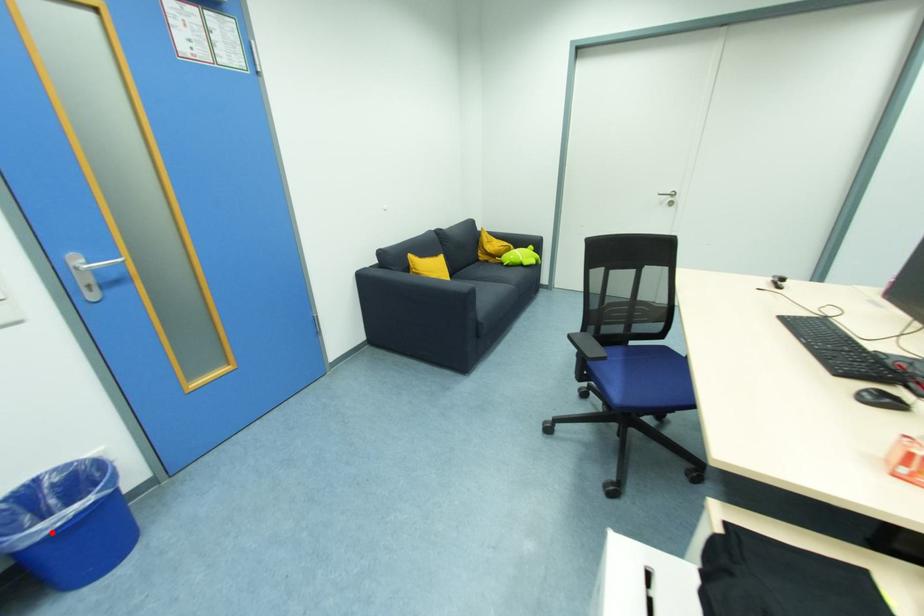
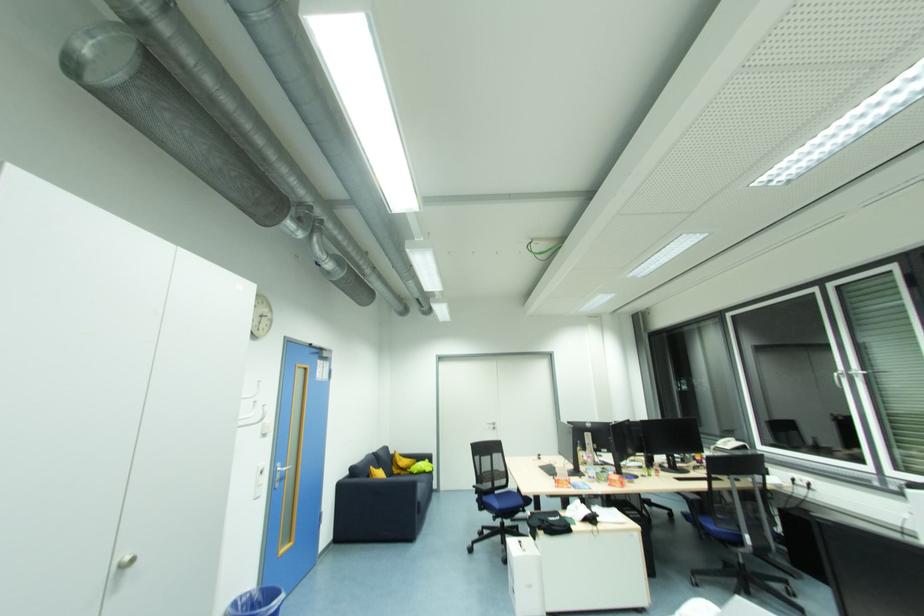
Question: I am providing you with two images of the same scene from different viewpoints. In image1, a red point is highlighted. Considering the same 3D point in image2, which of the following is correct?

Choices:
 (A) It is closer
 (B) It is farther

Answer: (A)